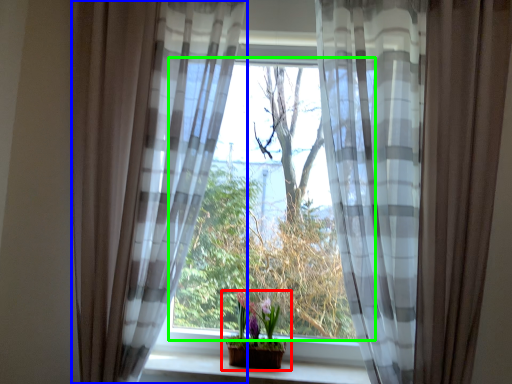
Question: Which object is positioned closest to houseplant (highlighted by a red box)? Select from curtain (highlighted by a blue box) and window (highlighted by a green box).

Choices:
 (A) curtain
 (B) window

Answer: (B)